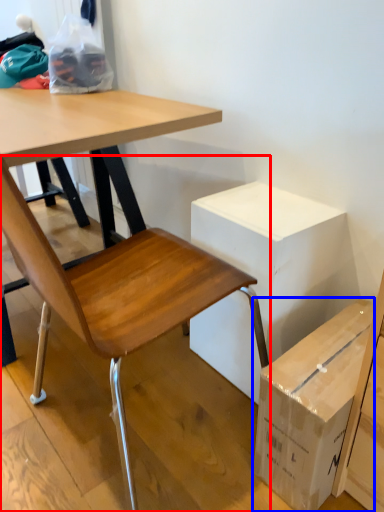
Question: Among these objects, which one is farthest to the camera, chair (highlighted by a red box) or box (highlighted by a blue box)?

Choices:
 (A) chair
 (B) box

Answer: (B)